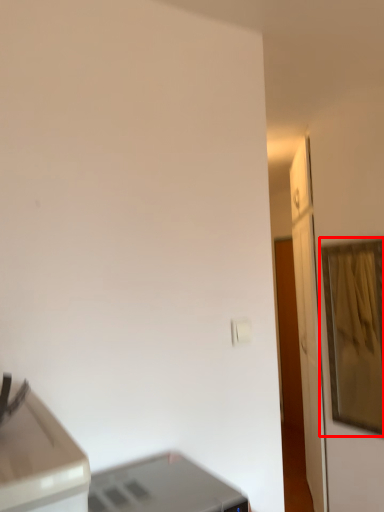
Question: In this image, where is picture frame (annotated by the red box) located relative to printer?

Choices:
 (A) left
 (B) right

Answer: (B)